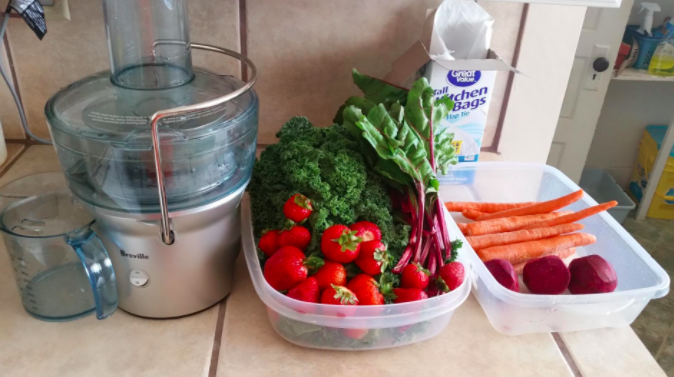
This screenshot has width=674, height=377. In order to click on backsplash in this screenshot , I will do `click(298, 41)`.